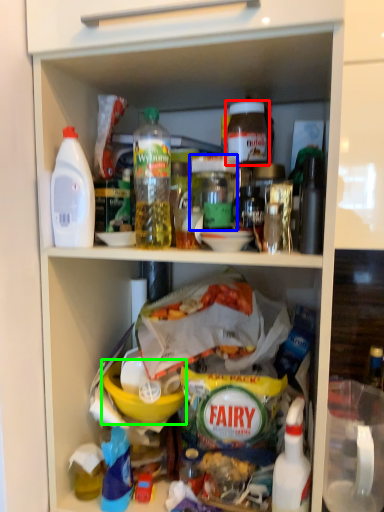
Question: Which is farther away from bottle (highlighted by a red box)? bottle (highlighted by a blue box) or bowl (highlighted by a green box)?

Choices:
 (A) bottle
 (B) bowl

Answer: (B)